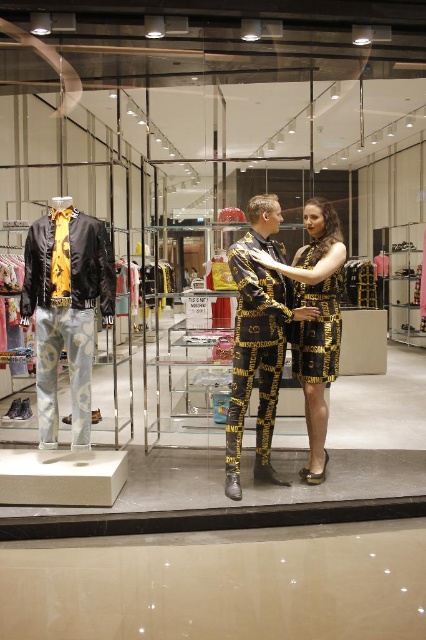
Question: Which point is farther from the camera taking this photo?

Choices:
 (A) (55, 442)
 (B) (236, 460)
 (C) (275, 356)
 (D) (333, 326)

Answer: (D)

Question: Does matte black jacket at left have a smaller size compared to gold metallic pants at center?

Choices:
 (A) yes
 (B) no

Answer: (A)

Question: Which point is farther from the camera taking this photo?

Choices:
 (A) (x=63, y=324)
 (B) (x=273, y=342)
 (C) (x=307, y=337)
 (D) (x=311, y=209)

Answer: (C)

Question: Does matte black jacket at left lie behind gold metallic dress at center?

Choices:
 (A) no
 (B) yes

Answer: (A)

Question: From the image, what is the correct spatial relationship of gold metallic suit at center in relation to matte black jacket at left?

Choices:
 (A) above
 (B) below

Answer: (B)

Question: Which of the following is the closest to the observer?

Choices:
 (A) (310, 321)
 (B) (268, 460)

Answer: (A)